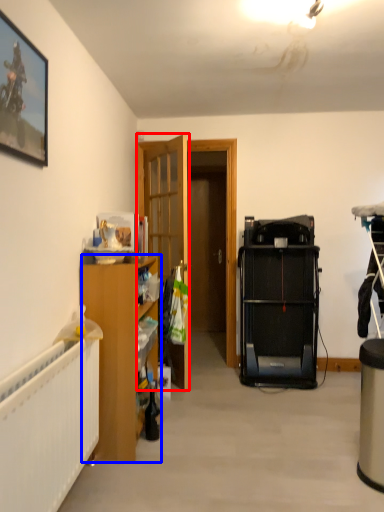
Question: Which object is further to the camera taking this photo, door (highlighted by a red box) or cabinetry (highlighted by a blue box)?

Choices:
 (A) door
 (B) cabinetry

Answer: (A)